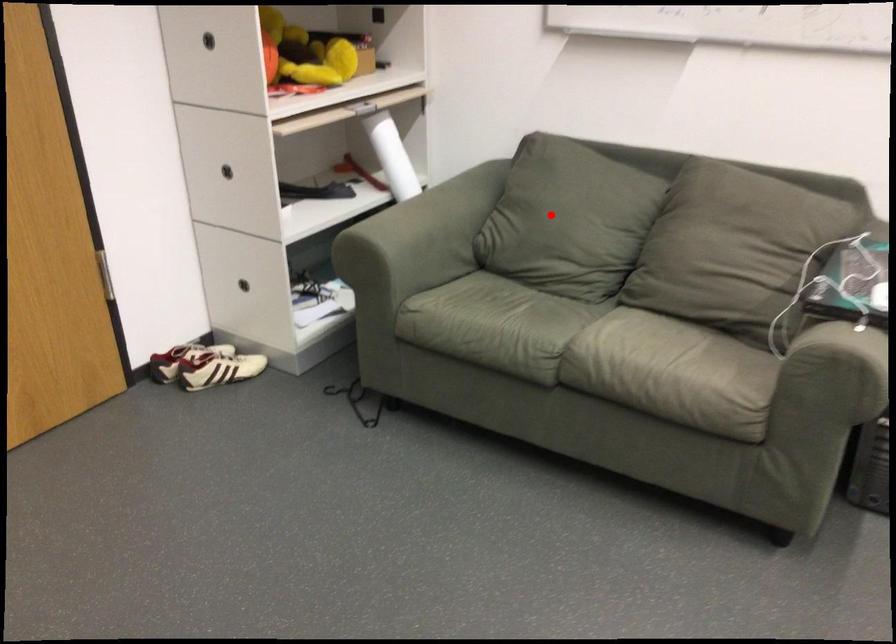
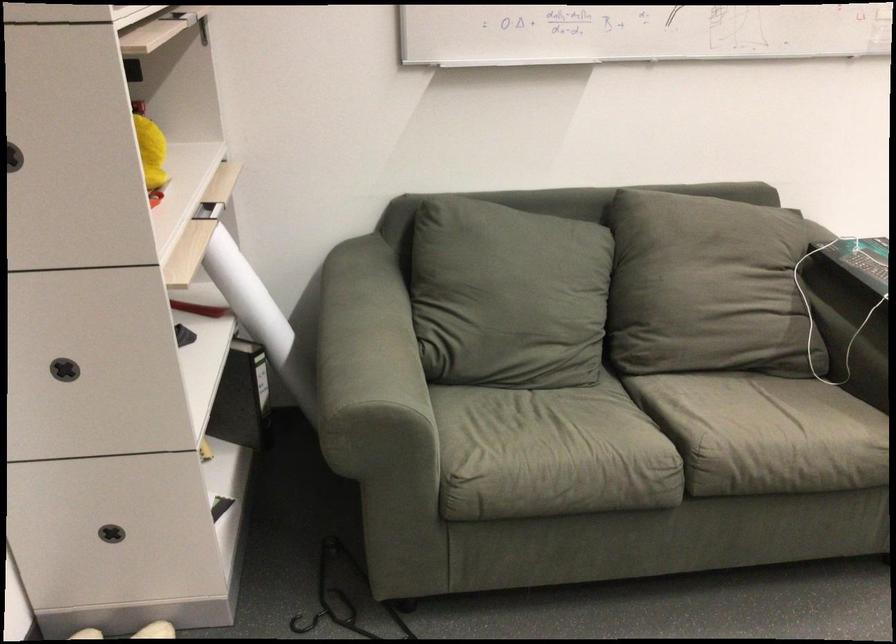
In the second image, find the point that corresponds to the highlighted location in the first image.

(506, 295)